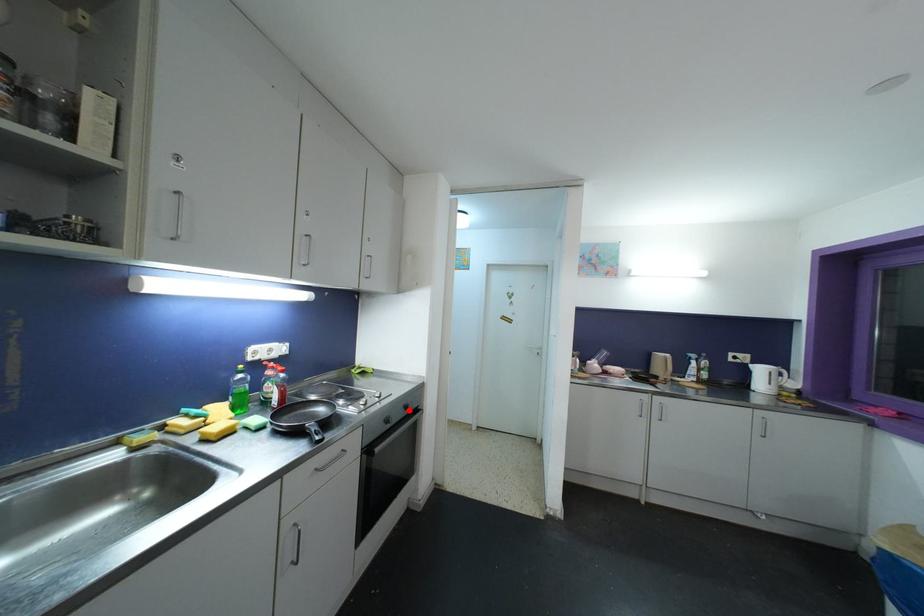
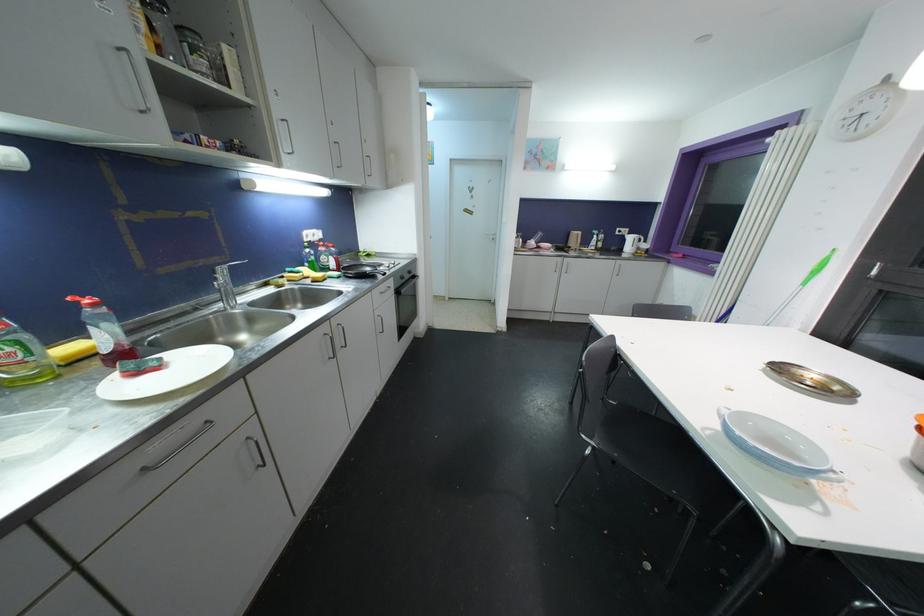
In the second image, find the point that corresponds to the highlighted location in the first image.

(412, 275)